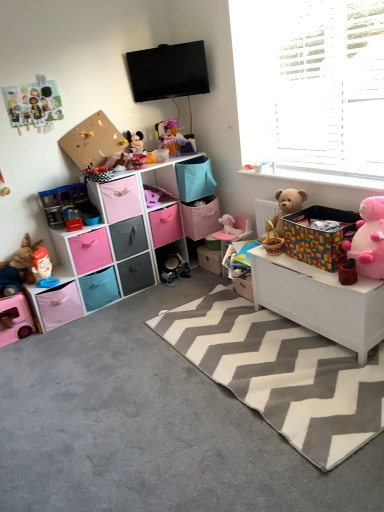
Question: Is gray carpet at lower left at the right side of gray chevron rug at center?

Choices:
 (A) no
 (B) yes

Answer: (A)

Question: Considering the relative sizes of gray carpet at lower left and gray chevron rug at center in the image provided, is gray carpet at lower left wider than gray chevron rug at center?

Choices:
 (A) no
 (B) yes

Answer: (B)

Question: Are gray carpet at lower left and gray chevron rug at center far apart?

Choices:
 (A) yes
 (B) no

Answer: (B)

Question: Considering the relative sizes of gray carpet at lower left and gray chevron rug at center in the image provided, is gray carpet at lower left smaller than gray chevron rug at center?

Choices:
 (A) yes
 (B) no

Answer: (B)

Question: Considering the relative sizes of gray carpet at lower left and gray chevron rug at center in the image provided, is gray carpet at lower left taller than gray chevron rug at center?

Choices:
 (A) no
 (B) yes

Answer: (A)

Question: Would you say gray chevron rug at center is inside or outside matte plastic mickey mouse at center, arranged as the third toy when viewed from the right?

Choices:
 (A) inside
 (B) outside

Answer: (B)

Question: Considering the positions of point tap(306, 372) and point tap(129, 159), is point tap(306, 372) closer or farther from the camera than point tap(129, 159)?

Choices:
 (A) farther
 (B) closer

Answer: (B)

Question: Considering the positions of gray chevron rug at center and matte plastic mickey mouse at center, arranged as the third toy when viewed from the right, in the image, is gray chevron rug at center wider or thinner than matte plastic mickey mouse at center, arranged as the third toy when viewed from the right,?

Choices:
 (A) thin
 (B) wide

Answer: (B)

Question: Based on their positions, is gray chevron rug at center located to the left or right of matte plastic mickey mouse at center, arranged as the third toy when viewed from the right?

Choices:
 (A) right
 (B) left

Answer: (A)

Question: Based on their positions, is pink fabric drawer at center, placed as the 5th drawer when sorted from top to bottom, located to the left or right of matte cardboard box at center, which is the 3th storage box in left-to-right order?

Choices:
 (A) left
 (B) right

Answer: (A)

Question: Looking at their shapes, would you say pink fabric drawer at center, positioned as the second drawer in bottom-to-top order, is wider or thinner than matte cardboard box at center, which is counted as the 2th storage box, starting from the right?

Choices:
 (A) thin
 (B) wide

Answer: (B)

Question: From their relative heights in the image, would you say pink fabric drawer at center, positioned as the second drawer in bottom-to-top order, is taller or shorter than matte cardboard box at center, which is the 3th storage box in left-to-right order?

Choices:
 (A) tall
 (B) short

Answer: (A)

Question: In terms of size, does pink fabric drawer at center, placed as the 5th drawer when sorted from top to bottom, appear bigger or smaller than matte cardboard box at center, which is counted as the 2th storage box, starting from the right?

Choices:
 (A) big
 (B) small

Answer: (A)

Question: Considering their positions, is gray chevron rug at center located in front of or behind matte cardboard box at center, which is counted as the 2th storage box, starting from the right?

Choices:
 (A) behind
 (B) front

Answer: (B)

Question: Based on their positions, is gray chevron rug at center located to the left or right of matte cardboard box at center, which is the 3th storage box in left-to-right order?

Choices:
 (A) right
 (B) left

Answer: (A)